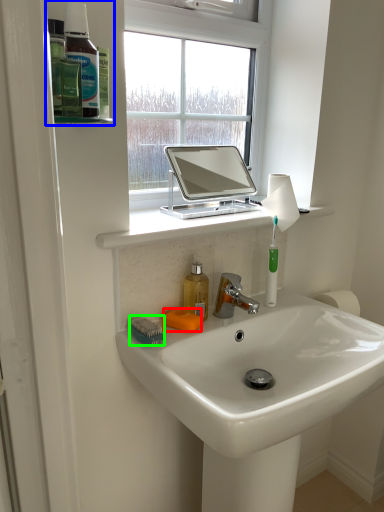
Question: Which is farther away from soap (highlighted by a red box)? shelf (highlighted by a blue box) or brush (highlighted by a green box)?

Choices:
 (A) shelf
 (B) brush

Answer: (A)